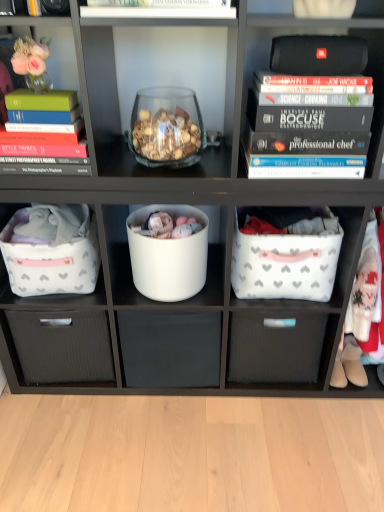
Question: Considering the relative sizes of black matte speaker at upper right and white matte bucket at center in the image provided, is black matte speaker at upper right wider than white matte bucket at center?

Choices:
 (A) yes
 (B) no

Answer: (B)

Question: From the image's perspective, is black matte speaker at upper right beneath white matte bucket at center?

Choices:
 (A) yes
 (B) no

Answer: (B)

Question: Is white matte bucket at center at the back of black matte speaker at upper right?

Choices:
 (A) no
 (B) yes

Answer: (A)

Question: Can you confirm if black matte speaker at upper right is bigger than white matte bucket at center?

Choices:
 (A) yes
 (B) no

Answer: (B)

Question: From a real-world perspective, is black matte speaker at upper right positioned over white matte bucket at center based on gravity?

Choices:
 (A) no
 (B) yes

Answer: (B)

Question: Considering the positions of white matte bucket at center and matte green hardcover book at left in the image, is white matte bucket at center taller or shorter than matte green hardcover book at left?

Choices:
 (A) tall
 (B) short

Answer: (A)

Question: Is white matte bucket at center in front of or behind matte green hardcover book at left in the image?

Choices:
 (A) behind
 (B) front

Answer: (A)

Question: Considering the relative positions of white matte bucket at center and matte green hardcover book at left in the image provided, is white matte bucket at center to the left or to the right of matte green hardcover book at left?

Choices:
 (A) right
 (B) left

Answer: (A)

Question: Considering the positions of point (198, 268) and point (8, 138), is point (198, 268) closer or farther from the camera than point (8, 138)?

Choices:
 (A) farther
 (B) closer

Answer: (A)

Question: In terms of height, does black hardcover books at upper right look taller or shorter compared to white fabric drawer at center, arranged as the second drawer when viewed from the left?

Choices:
 (A) tall
 (B) short

Answer: (B)

Question: Is black hardcover books at upper right situated inside white fabric drawer at center, arranged as the second drawer when viewed from the left, or outside?

Choices:
 (A) inside
 (B) outside

Answer: (B)

Question: From the image's perspective, is black hardcover books at upper right positioned above or below white fabric drawer at center, the 1th drawer viewed from the right?

Choices:
 (A) below
 (B) above

Answer: (B)

Question: In terms of width, does black hardcover books at upper right look wider or thinner when compared to white fabric drawer at center, the 1th drawer viewed from the right?

Choices:
 (A) thin
 (B) wide

Answer: (B)

Question: From the image's perspective, is white matte drawer at center, the first drawer when ordered from left to right, positioned above or below white matte bucket at center?

Choices:
 (A) below
 (B) above

Answer: (A)

Question: From a real-world perspective, relative to white matte bucket at center, is white matte drawer at center, placed as the 2th drawer when sorted from right to left, vertically above or below?

Choices:
 (A) above
 (B) below

Answer: (B)